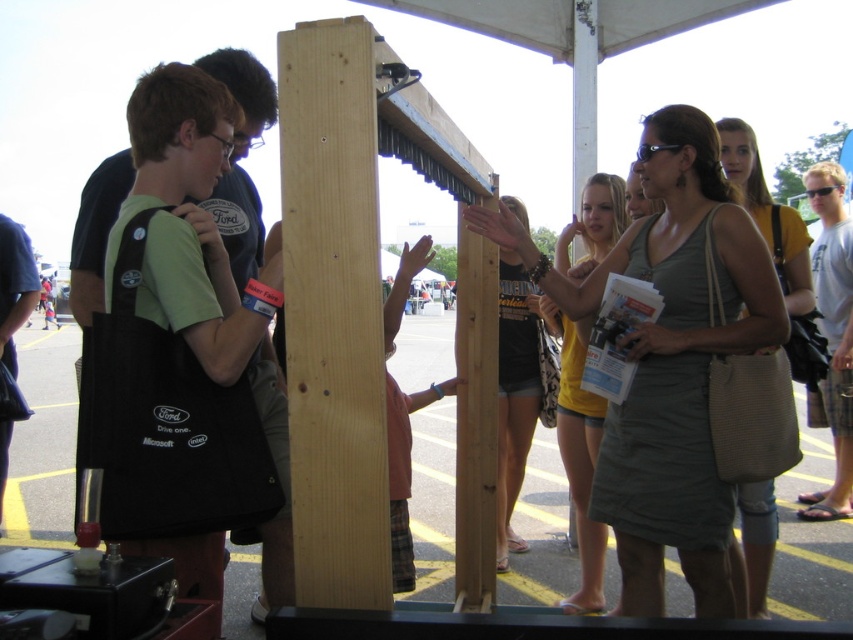
You are attending a tech fair and see the dark blue shirt at left and the black plastic goggles at upper right. Which object is closer to you?

The dark blue shirt at left is closer to you because it is in front of the black plastic goggles at upper right.